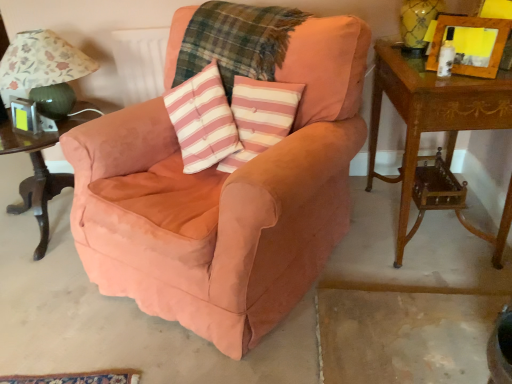
Question: Is wooden carved side table at right, arranged as the 2th table when viewed from the left, thinner than metallic silver picture frame at left, acting as the second picture frame starting from the front?

Choices:
 (A) yes
 (B) no

Answer: (B)

Question: Does wooden carved side table at right, the first table viewed from the right, have a lesser height compared to metallic silver picture frame at left, which is counted as the second picture frame, starting from the right?

Choices:
 (A) no
 (B) yes

Answer: (A)

Question: From a real-world perspective, is wooden carved side table at right, the first table viewed from the right, physically above metallic silver picture frame at left, arranged as the 1th picture frame when viewed from the back?

Choices:
 (A) no
 (B) yes

Answer: (A)

Question: Is wooden carved side table at right, the first table viewed from the right, facing away from metallic silver picture frame at left, positioned as the 1th picture frame in bottom-to-top order?

Choices:
 (A) no
 (B) yes

Answer: (A)

Question: From the image's perspective, is wooden carved side table at right, arranged as the 2th table when viewed from the left, over metallic silver picture frame at left, which is counted as the second picture frame, starting from the right?

Choices:
 (A) yes
 (B) no

Answer: (B)

Question: Does wooden carved side table at right, arranged as the 2th table when viewed from the left, come behind metallic silver picture frame at left, acting as the second picture frame starting from the front?

Choices:
 (A) yes
 (B) no

Answer: (B)

Question: Is pink striped fabric pillow at center surrounded by wooden picture frame at upper right, the second picture frame from the bottom?

Choices:
 (A) no
 (B) yes

Answer: (A)

Question: Considering the relative sizes of wooden picture frame at upper right, which is counted as the 1th picture frame, starting from the right, and pink striped fabric pillow at center in the image provided, is wooden picture frame at upper right, which is counted as the 1th picture frame, starting from the right, wider than pink striped fabric pillow at center?

Choices:
 (A) no
 (B) yes

Answer: (A)

Question: Is wooden picture frame at upper right, which is the 1th picture frame in front-to-back order, to the left of pink striped fabric pillow at center from the viewer's perspective?

Choices:
 (A) no
 (B) yes

Answer: (A)

Question: From a real-world perspective, is wooden picture frame at upper right, which is the 1th picture frame in front-to-back order, positioned under pink striped fabric pillow at center based on gravity?

Choices:
 (A) no
 (B) yes

Answer: (A)

Question: Can you confirm if wooden picture frame at upper right, which appears as the 2th picture frame when viewed from the back, is shorter than pink striped fabric pillow at center?

Choices:
 (A) yes
 (B) no

Answer: (A)

Question: Does wooden picture frame at upper right, the 2th picture frame in the left-to-right sequence, have a greater height compared to pink striped fabric pillow at center?

Choices:
 (A) no
 (B) yes

Answer: (A)

Question: Does floral fabric lampshade at left come in front of wooden carved side table at right, the first table viewed from the right?

Choices:
 (A) no
 (B) yes

Answer: (A)